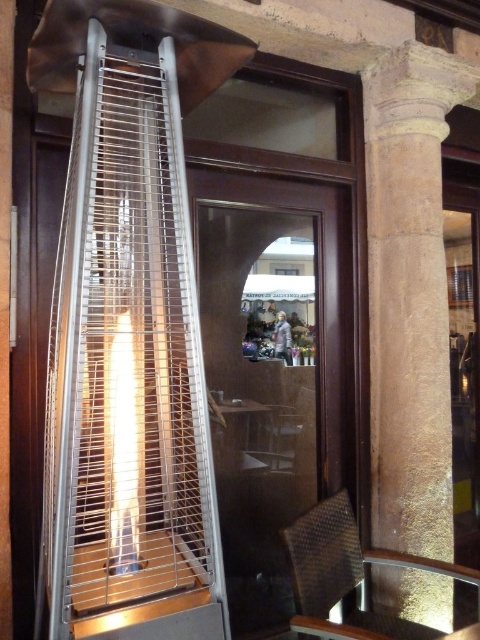
Find the location of a particular element. The image size is (480, 640). metallic wire birdcage at left is located at coordinates pyautogui.click(x=128, y=332).

Is point (117, 92) behind point (384, 227)?

That is False.

Where is `metallic wire birdcage at left`? metallic wire birdcage at left is located at coordinates (128, 332).

Is metallic wire birdcage at left wider than metallic woven chair at lower right?

No.

Between metallic wire birdcage at left and metallic woven chair at lower right, which one appears on the left side from the viewer's perspective?

From the viewer's perspective, metallic wire birdcage at left appears more on the left side.

Is point (111, 360) farther from camera compared to point (327, 621)?

No, it is not.

Find the location of a particular element. metallic wire birdcage at left is located at coordinates (128, 332).

In the scene shown: Is stone column at right shorter than metallic woven chair at lower right?

In fact, stone column at right may be taller than metallic woven chair at lower right.

Which is above, stone column at right or metallic woven chair at lower right?

→ stone column at right is higher up.

Identify the location of stone column at right. This screenshot has height=640, width=480. (409, 294).